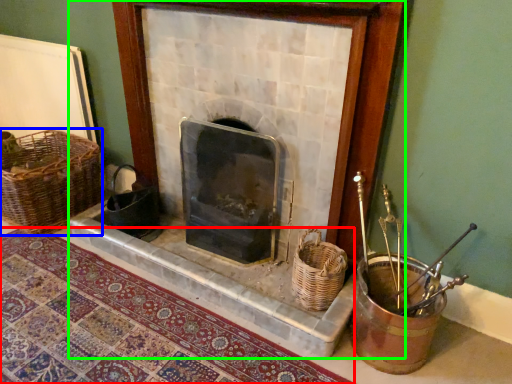
Question: Based on their relative distances, which object is farther from mat (highlighted by a red box)? Choose from basket (highlighted by a blue box) and fireplace (highlighted by a green box).

Choices:
 (A) basket
 (B) fireplace

Answer: (A)